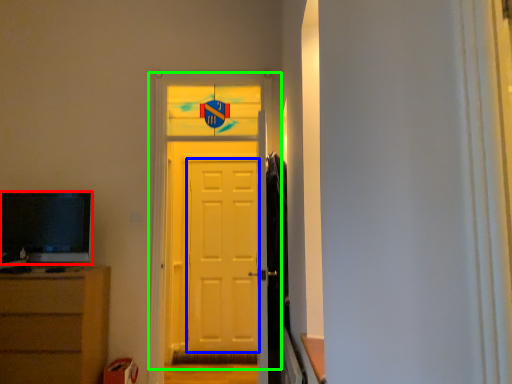
Question: Which object is positioned closest to television (highlighted by a red box)? Select from screen door (highlighted by a blue box) and door (highlighted by a green box).

Choices:
 (A) screen door
 (B) door

Answer: (B)